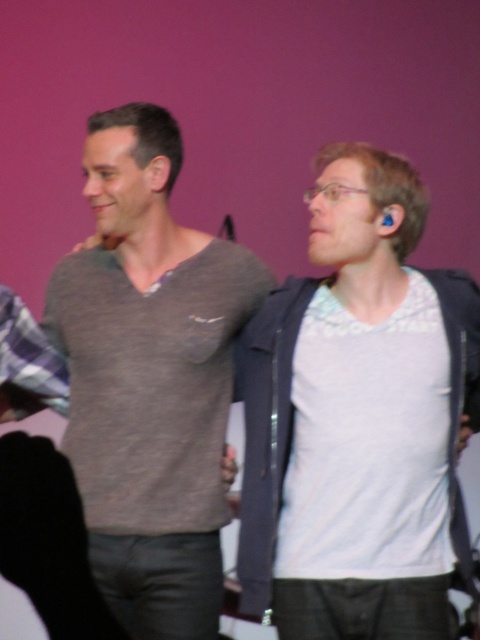
You are a costume designer preparing for a play. You have two gray sweaters available for the main character. The gray soft sweater at center and the gray matte sweater at center. Which one should you choose if the character needs a larger size for a costume that requires a more voluminous look?

The gray soft sweater at center is bigger than the gray matte sweater at center, so you should choose the gray soft sweater at center for the larger, more voluminous look.

You are organizing a clothing store and need to arrange the gray soft sweater at center and the gray matte sweater at center on a hanger rack. According to the image, which sweater should be placed to the left of the other?

The gray soft sweater at center should be placed to the left of the gray matte sweater at center because the gray soft sweater at center is positioned on the left side of gray matte sweater at center in the image.

You are designing a clothing catalog layout and need to place both the gray soft sweater at center and the gray matte sweater at center side by side. Given their widths, which sweater should be placed on the left to ensure they fit within a 1.5 meter wide display area?

The gray soft sweater at center is wider than the gray matte sweater at center. To fit both within the 1.5 meter display area, place the wider gray soft sweater at center on the left and the narrower gray matte sweater at center on the right, ensuring their combined width does not exceed the available space.